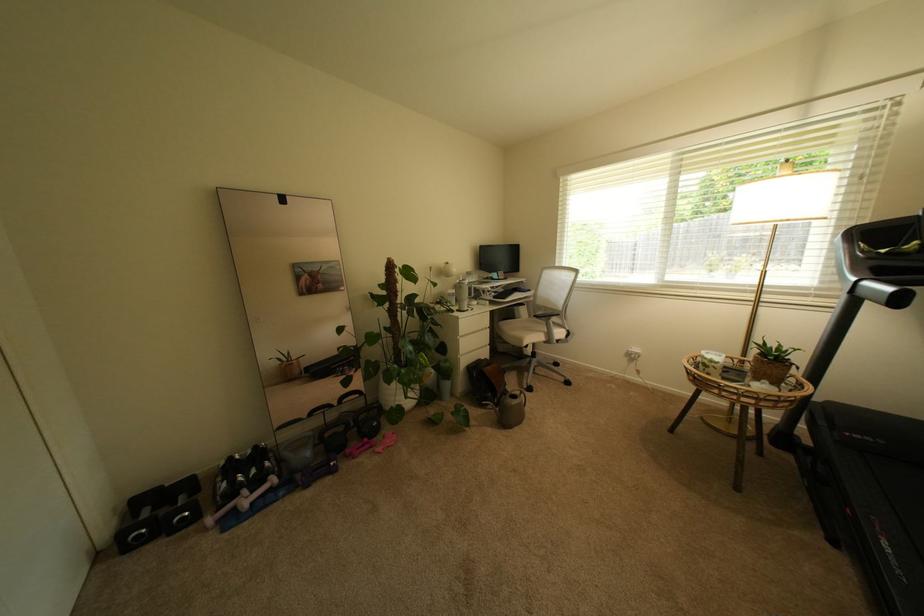
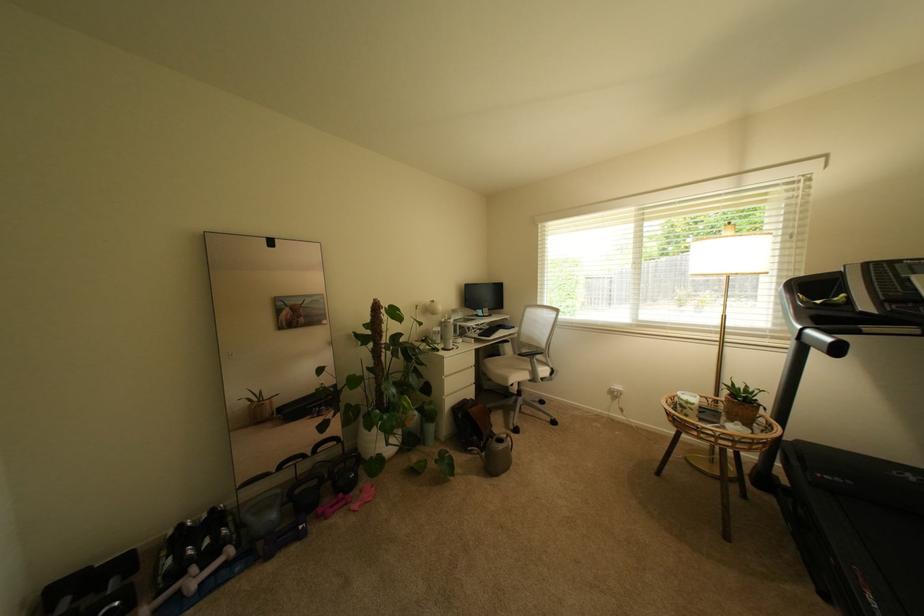
Locate, in the second image, the point that corresponds to (x=238, y=459) in the first image.

(188, 527)